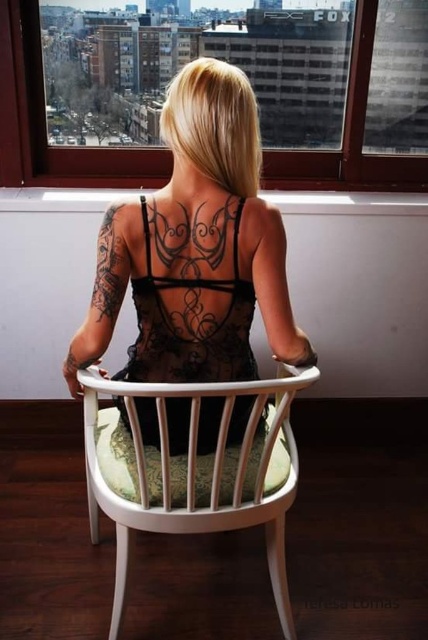
Question: Considering the relative positions of transparent glass window at upper center and black lace dress at center in the image provided, where is transparent glass window at upper center located with respect to black lace dress at center?

Choices:
 (A) left
 (B) right

Answer: (A)

Question: Does transparent glass window at upper center appear over black ink tattoo at upper left?

Choices:
 (A) no
 (B) yes

Answer: (B)

Question: Based on their relative distances, which object is nearer to the black lace dress at center?

Choices:
 (A) black ink tattoo at center back
 (B) black lace tattoo at upper center
 (C) transparent glass window at upper center

Answer: (B)

Question: Is transparent glass window at upper center further to the viewer compared to black ink tattoo at center back?

Choices:
 (A) yes
 (B) no

Answer: (A)

Question: Which point is farther to the camera?

Choices:
 (A) white wood chair at center
 (B) black ink tattoo at center back
 (C) black lace tattoo at upper center

Answer: (B)

Question: Which of these objects is positioned farthest from the white wood chair at center?

Choices:
 (A) black lace tattoo at upper center
 (B) black ink tattoo at center back
 (C) transparent glass window at upper center
 (D) black lace dress at center

Answer: (C)